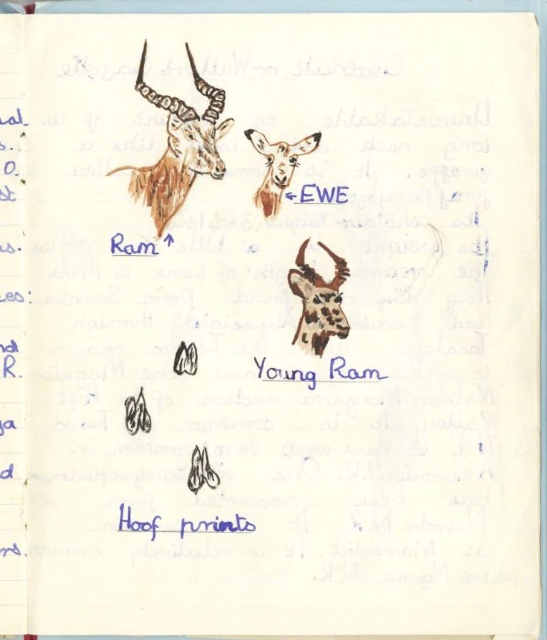
Who is taller, brown textured ram at upper left or brown textured head at upper center?

brown textured ram at upper left is taller.

Which is more to the right, brown textured ram at upper left or brown textured head at upper center?

brown textured head at upper center is more to the right.

Describe the element at coordinates (178, 147) in the screenshot. I see `brown textured ram at upper left` at that location.

The width and height of the screenshot is (547, 640). What are the coordinates of `brown textured ram at upper left` in the screenshot? It's located at (178, 147).

Is brown textured ram at upper left wider than speckled fur young ram at center?

Correct, the width of brown textured ram at upper left exceeds that of speckled fur young ram at center.

Which is behind, point (190, 58) or point (318, 324)?

Positioned behind is point (318, 324).

In order to click on brown textured ram at upper left in this screenshot , I will do `click(178, 147)`.

Between speckled fur young ram at center and brown textured head at upper center, which one appears on the right side from the viewer's perspective?

speckled fur young ram at center is more to the right.

Can you confirm if speckled fur young ram at center is taller than brown textured head at upper center?

Yes, speckled fur young ram at center is taller than brown textured head at upper center.

Find the location of a particular element. This screenshot has height=640, width=547. speckled fur young ram at center is located at coordinates (317, 301).